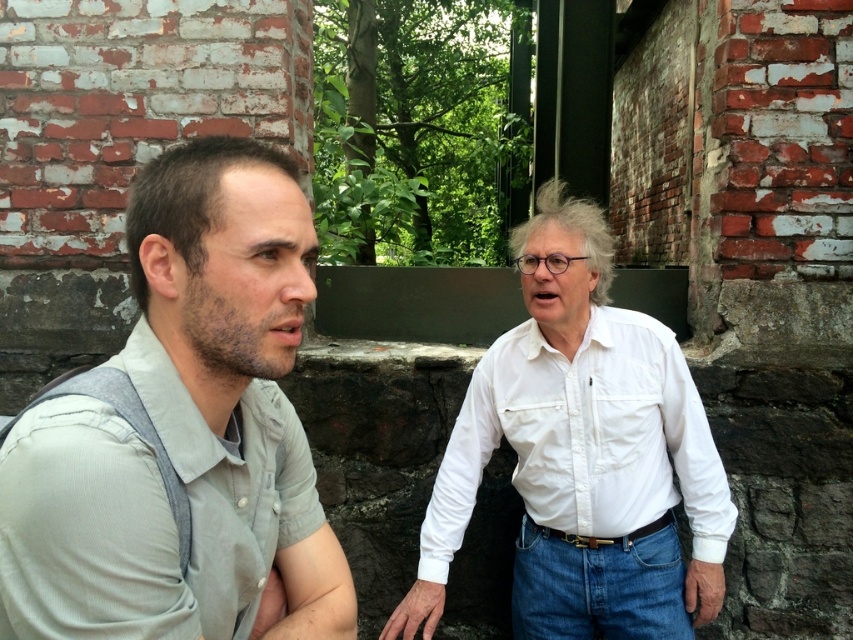
Question: Among these objects, which one is nearest to the camera?

Choices:
 (A) white cotton shirt at center
 (B) gray cotton shirt at left

Answer: (B)

Question: Considering the relative positions of gray cotton shirt at left and white cotton shirt at center in the image provided, where is gray cotton shirt at left located with respect to white cotton shirt at center?

Choices:
 (A) left
 (B) right

Answer: (A)

Question: Can you confirm if gray cotton shirt at left is wider than white cotton shirt at center?

Choices:
 (A) yes
 (B) no

Answer: (B)

Question: Does gray cotton shirt at left have a greater width compared to white cotton shirt at center?

Choices:
 (A) yes
 (B) no

Answer: (B)